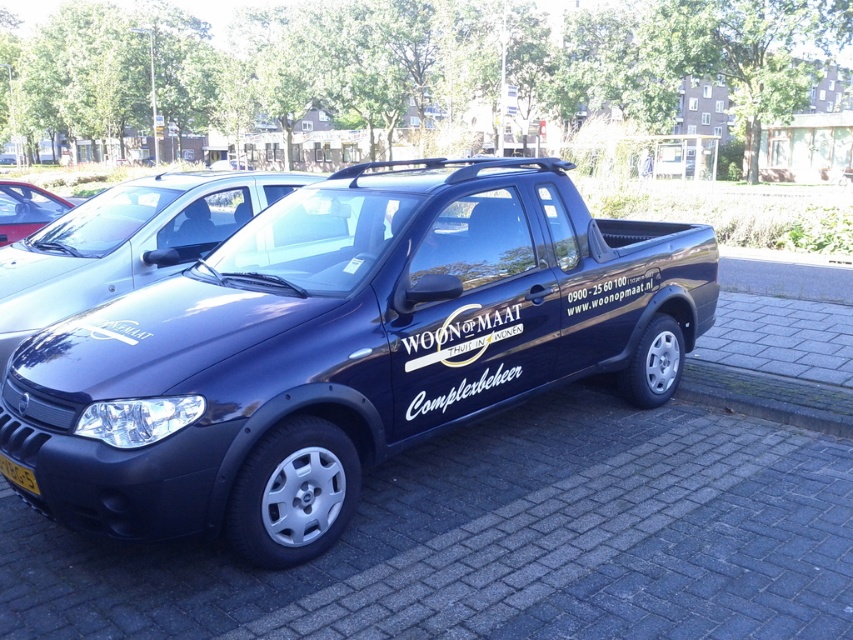
Can you confirm if glossy blue truck at center is thinner than matte black pickup truck at center?

Yes, glossy blue truck at center is thinner than matte black pickup truck at center.

What do you see at coordinates (126, 243) in the screenshot? I see `glossy blue truck at center` at bounding box center [126, 243].

Is point (163, 252) behind point (3, 237)?

No.

Where is `glossy blue truck at center`? The height and width of the screenshot is (640, 853). glossy blue truck at center is located at coordinates 126,243.

Who is positioned more to the left, glossy dark blue pickup truck at center or glossy blue truck at center?

From the viewer's perspective, glossy blue truck at center appears more on the left side.

Can you confirm if glossy dark blue pickup truck at center is positioned below glossy blue truck at center?

Yes.

Who is more distant from viewer, (213, 353) or (3, 323)?

The point (3, 323) is more distant.

Where is `glossy dark blue pickup truck at center`? glossy dark blue pickup truck at center is located at coordinates (343, 348).

Is glossy dark blue pickup truck at center taller than matte black pickup truck at center?

No.

Is glossy dark blue pickup truck at center wider than matte black pickup truck at center?

No.

What do you see at coordinates (343, 348) in the screenshot? I see `glossy dark blue pickup truck at center` at bounding box center [343, 348].

This screenshot has height=640, width=853. Identify the location of glossy dark blue pickup truck at center. pos(343,348).